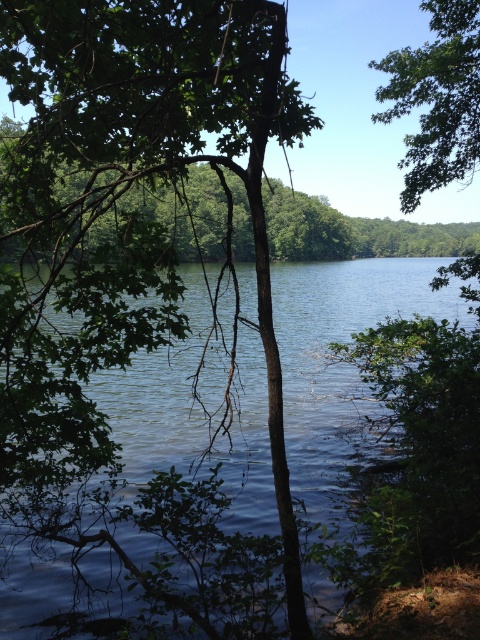
Does point (279, 321) come closer to viewer compared to point (472, 60)?

No.

Is blue water at center smaller than green leafy tree at upper right?

Actually, blue water at center might be larger than green leafy tree at upper right.

What do you see at coordinates (154, 516) in the screenshot?
I see `blue water at center` at bounding box center [154, 516].

Locate an element on the screen. The image size is (480, 640). blue water at center is located at coordinates coord(154,516).

Does green leafy tree at upper right have a lesser width compared to brown dirt at lower right?

No, green leafy tree at upper right is not thinner than brown dirt at lower right.

Does green leafy tree at upper right have a larger size compared to brown dirt at lower right?

Correct, green leafy tree at upper right is larger in size than brown dirt at lower right.

Between point (441, 179) and point (474, 637), which one is positioned behind?

Point (441, 179)

Where is `green leafy tree at upper right`? The height and width of the screenshot is (640, 480). green leafy tree at upper right is located at coordinates (436, 99).

Does point (304, 332) come in front of point (409, 600)?

No, it is not.

Can you confirm if blue water at center is shorter than brown dirt at lower right?

No.

Who is more distant from viewer, [276,552] or [455,614]?

The point [276,552] is behind.

Locate an element on the screen. Image resolution: width=480 pixels, height=640 pixels. blue water at center is located at coordinates (154, 516).